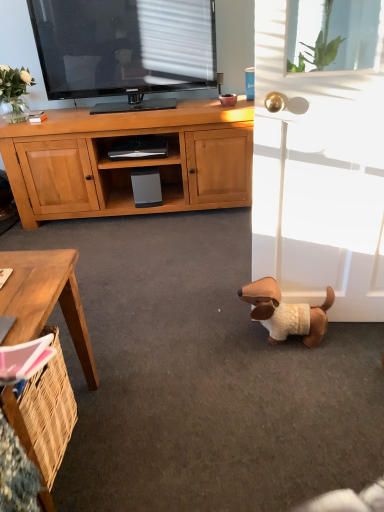
Question: Based on their sizes in the image, would you say white matte screen door at lower right is bigger or smaller than white glass vase at upper left?

Choices:
 (A) big
 (B) small

Answer: (A)

Question: From a real-world perspective, is white matte screen door at lower right physically located above or below white glass vase at upper left?

Choices:
 (A) below
 (B) above

Answer: (A)

Question: Estimate the real-world distances between objects in this image. Which object is farther from the white matte screen door at lower right?

Choices:
 (A) brown plush dog at lower right
 (B) brown wooden desk at lower left
 (C) white glass vase at upper left
 (D) transparent glass window screen at upper right

Answer: (C)

Question: Based on their relative distances, which object is nearer to the brown plush dog at lower right?

Choices:
 (A) transparent glass window screen at upper right
 (B) brown wooden desk at lower left
 (C) white matte screen door at lower right
 (D) white glass vase at upper left

Answer: (C)